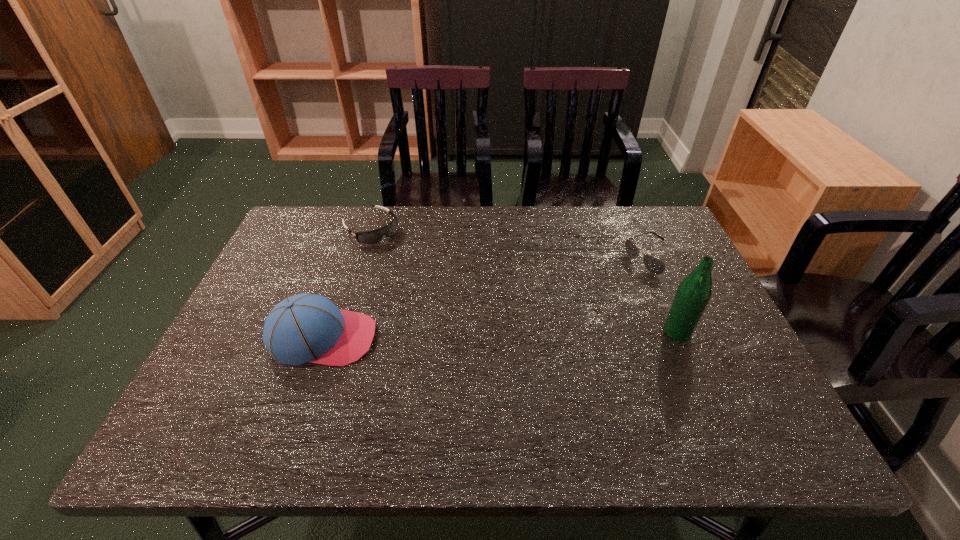
Where is `free spot on the desktop that is between the third shortest object and the tallest object and is positioned on the front-facing side of the sunglasses`? This screenshot has height=540, width=960. free spot on the desktop that is between the third shortest object and the tallest object and is positioned on the front-facing side of the sunglasses is located at coordinates (508, 335).

The width and height of the screenshot is (960, 540). Identify the location of vacant space on the desktop that is between the baseball cap and the tallest object and is positioned on the front and sides of the goggles. (492, 335).